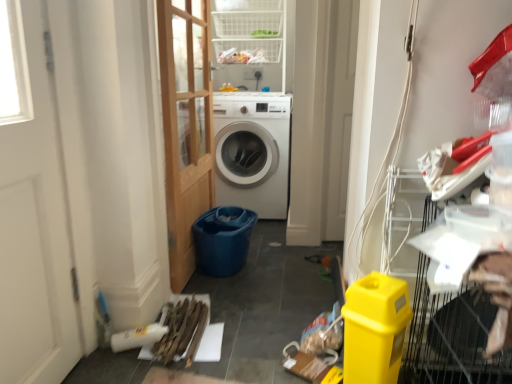
The image size is (512, 384). What are the coordinates of `vacant area located to the right-hand side of wooden planks at lower left` in the screenshot? It's located at (253, 326).